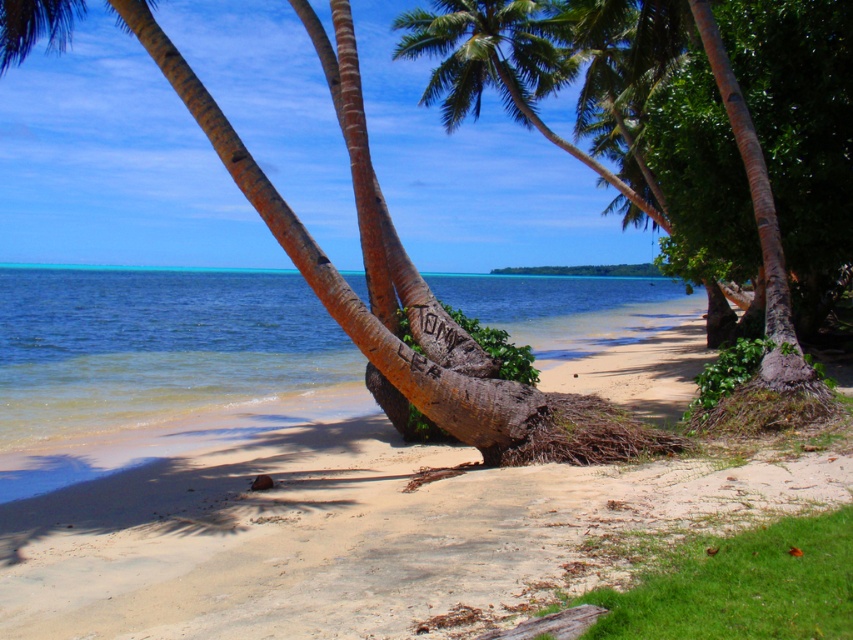
Question: Which of the following is the closest to the observer?

Choices:
 (A) clear blue water at center
 (B) sandy beach at center

Answer: (B)

Question: Can you confirm if sandy beach at center is wider than clear blue water at center?

Choices:
 (A) no
 (B) yes

Answer: (A)

Question: Which point is farther to the camera?

Choices:
 (A) sandy beach at center
 (B) clear blue water at center

Answer: (B)

Question: Is sandy beach at center below clear blue water at center?

Choices:
 (A) yes
 (B) no

Answer: (A)

Question: Is sandy beach at center wider than clear blue water at center?

Choices:
 (A) yes
 (B) no

Answer: (B)